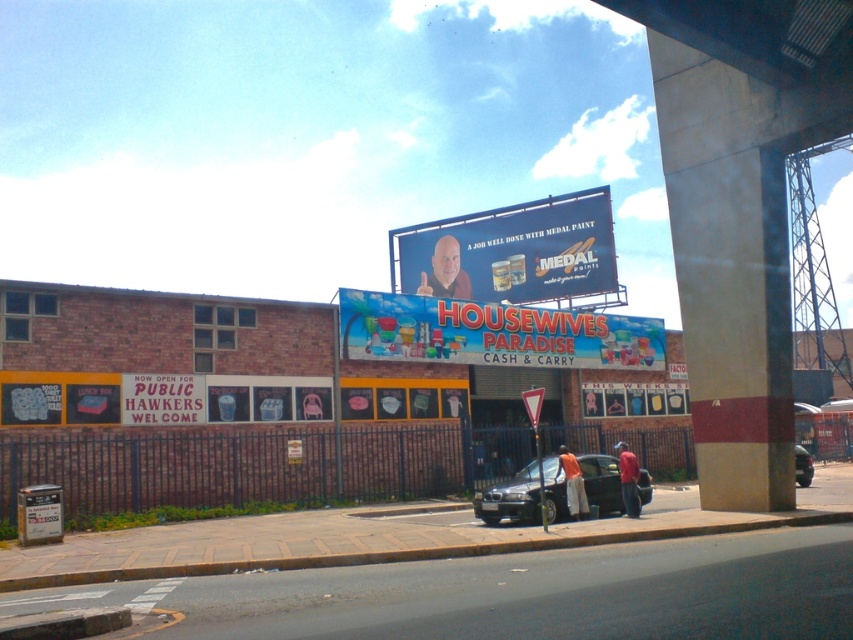
Question: Can you confirm if matte plastic billboard at center is positioned below blue plastic signboard at center?

Choices:
 (A) yes
 (B) no

Answer: (B)

Question: Which object is closer to the camera taking this photo?

Choices:
 (A) metallic silver sign at lower center
 (B) white plastic sign at lower left
 (C) shiny black car at center
 (D) metallic gray sedan at lower right

Answer: (D)

Question: Which object is positioned farthest from the white plastic sign at lower left?

Choices:
 (A) blue plastic signboard at center
 (B) shiny black car at center

Answer: (B)

Question: Does metallic silver sign at lower center lie in front of metallic gray sedan at lower right?

Choices:
 (A) yes
 (B) no

Answer: (B)

Question: Which object is closer to the camera taking this photo?

Choices:
 (A) metallic silver sign at lower center
 (B) shiny black car at center
 (C) metallic gray sedan at lower right
 (D) matte plastic billboard at center

Answer: (C)

Question: Can you confirm if blue plastic signboard at center is smaller than white plastic sign at lower left?

Choices:
 (A) no
 (B) yes

Answer: (A)